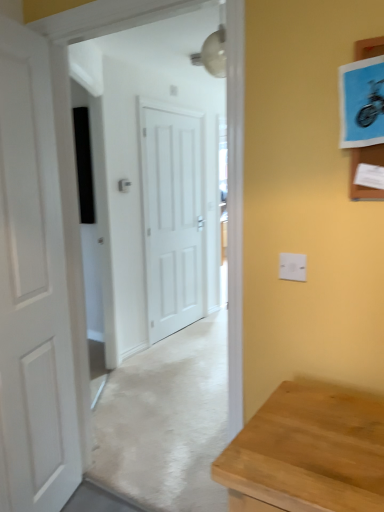
Where is `white matte door at left, the 1th door from the front`? The image size is (384, 512). white matte door at left, the 1th door from the front is located at coordinates (33, 289).

Is white matte door at center, which appears as the second door when viewed from the left, closer to the viewer compared to white matte door at left, the second door positioned from the back?

No, it is behind white matte door at left, the second door positioned from the back.

Consider the image. Which point is more distant from viewer, (159, 153) or (38, 59)?

The point (159, 153) is behind.

What's the angular difference between white matte door at center, which appears as the second door when viewed from the left, and white matte door at left, the first door positioned from the left,'s facing directions?

The facing directions of white matte door at center, which appears as the second door when viewed from the left, and white matte door at left, the first door positioned from the left, are 20 degrees apart.

From a real-world perspective, which is physically below, white matte door at center, which appears as the second door when viewed from the left, or white matte door at left, the first door positioned from the left?

In real-world perspective, white matte door at left, the first door positioned from the left, is lower.

Which of these two, white plastic electric outlet at upper right or white matte door at left, the second door positioned from the back, is smaller?

white plastic electric outlet at upper right is smaller.

Is white plastic electric outlet at upper right at the right side of white matte door at left, acting as the second door starting from the right?

Correct, you'll find white plastic electric outlet at upper right to the right of white matte door at left, acting as the second door starting from the right.

Who is shorter, white plastic electric outlet at upper right or white matte door at left, the first door positioned from the left?

With less height is white plastic electric outlet at upper right.

How far apart are white plastic electric outlet at upper right and white matte door at left, acting as the second door starting from the right?

white plastic electric outlet at upper right and white matte door at left, acting as the second door starting from the right, are 3.59 feet apart.

Can you confirm if white matte door at center, which appears as the second door when viewed from the left, is bigger than white plastic electric outlet at upper right?

Yes.

Is white matte door at center, which is the 1th door in right-to-left order, surrounding white plastic electric outlet at upper right?

That's incorrect, white plastic electric outlet at upper right is not inside white matte door at center, which is the 1th door in right-to-left order.

Based on the photo, from a real-world perspective, which is physically below, white matte door at center, which is the 1th door in right-to-left order, or white plastic electric outlet at upper right?

white matte door at center, which is the 1th door in right-to-left order, from a real-world perspective.

From their relative heights in the image, would you say white plastic electric outlet at upper right is taller or shorter than white matte door at center, which ranks as the first door in back-to-front order?

In the image, white plastic electric outlet at upper right appears to be shorter than white matte door at center, which ranks as the first door in back-to-front order.

Is white matte door at center, which is the 1th door in right-to-left order, a part of white plastic electric outlet at upper right?

No, white matte door at center, which is the 1th door in right-to-left order, is not a part of white plastic electric outlet at upper right.

Can you tell me how much white plastic electric outlet at upper right and white matte door at center, which appears as the second door when viewed from the left, differ in facing direction?

There is a 88.8-degree angle between the facing directions of white plastic electric outlet at upper right and white matte door at center, which appears as the second door when viewed from the left.

Between white plastic electric outlet at upper right and white matte door at center, which is the second door in front-to-back order, which one appears on the left side from the viewer's perspective?

white matte door at center, which is the second door in front-to-back order, is more to the left.

Is point (33, 360) positioned before point (284, 265)?

No, (33, 360) is behind (284, 265).

The width and height of the screenshot is (384, 512). In order to click on door that is the 2nd object directly below the white plastic electric outlet at upper right (from a real-world perspective) in this screenshot , I will do `click(33, 289)`.

From a real-world perspective, between white matte door at left, acting as the second door starting from the right, and white plastic electric outlet at upper right, who is vertically higher?

In real-world perspective, white plastic electric outlet at upper right is above.

How different are the orientations of white matte door at left, the first door positioned from the left, and white plastic electric outlet at upper right in degrees?

109 degrees.

Image resolution: width=384 pixels, height=512 pixels. What are the coordinates of `door in front of the white matte door at center, which ranks as the first door in back-to-front order` in the screenshot? It's located at (33, 289).

In terms of size, does white matte door at left, the first door positioned from the left, appear bigger or smaller than white matte door at center, which ranks as the first door in back-to-front order?

In the image, white matte door at left, the first door positioned from the left, appears to be larger than white matte door at center, which ranks as the first door in back-to-front order.

Does point (34, 500) appear closer or farther from the camera than point (151, 211)?

Point (34, 500) appears to be closer to the viewer than point (151, 211).

What's the angular difference between white matte door at left, the 1th door from the front, and white matte door at center, which appears as the second door when viewed from the left,'s facing directions?

The angle between the facing direction of white matte door at left, the 1th door from the front, and the facing direction of white matte door at center, which appears as the second door when viewed from the left, is 20 degrees.

In the image, there is a white matte door at left, the first door positioned from the left. At what (x,y) coordinates should I click in order to perform the action: click on door above it (from the image's perspective). Please return your answer as a coordinate pair (x, y). Looking at the image, I should click on (172, 216).

Where is `electric outlet located on the right of white matte door at left, acting as the second door starting from the right`? This screenshot has height=512, width=384. electric outlet located on the right of white matte door at left, acting as the second door starting from the right is located at coordinates (292, 267).

From the picture: Estimate the real-world distances between objects in this image. Which object is closer to white plastic electric outlet at upper right, white matte door at left, the second door positioned from the back, or white matte door at center, which is the 1th door in right-to-left order?

white matte door at left, the second door positioned from the back, is closer to white plastic electric outlet at upper right.

When comparing their distances from white matte door at center, which is the 1th door in right-to-left order, does white plastic electric outlet at upper right or white matte door at left, the first door positioned from the left, seem further?

Based on the image, white plastic electric outlet at upper right appears to be further to white matte door at center, which is the 1th door in right-to-left order.

Looking at the image, which one is located further to white plastic electric outlet at upper right, white matte door at center, which ranks as the first door in back-to-front order, or white matte door at left, the second door positioned from the back?

The object further to white plastic electric outlet at upper right is white matte door at center, which ranks as the first door in back-to-front order.

Looking at the image, which one is located further to white matte door at left, the second door positioned from the back, white matte door at center, which appears as the second door when viewed from the left, or white plastic electric outlet at upper right?

The object further to white matte door at left, the second door positioned from the back, is white matte door at center, which appears as the second door when viewed from the left.

Considering their positions, is white matte door at left, acting as the second door starting from the right, positioned further to white matte door at center, which is the second door in front-to-back order, than white plastic electric outlet at upper right?

white plastic electric outlet at upper right.

Estimate the real-world distances between objects in this image. Which object is closer to white matte door at left, acting as the second door starting from the right, white plastic electric outlet at upper right or white matte door at center, which appears as the second door when viewed from the left?

white plastic electric outlet at upper right lies closer to white matte door at left, acting as the second door starting from the right, than the other object.

At what (x,y) coordinates should I click in order to perform the action: click on electric outlet between white matte door at left, the 1th door from the front, and white matte door at center, which ranks as the first door in back-to-front order, along the z-axis. Please return your answer as a coordinate pair (x, y). The width and height of the screenshot is (384, 512). Looking at the image, I should click on (292, 267).